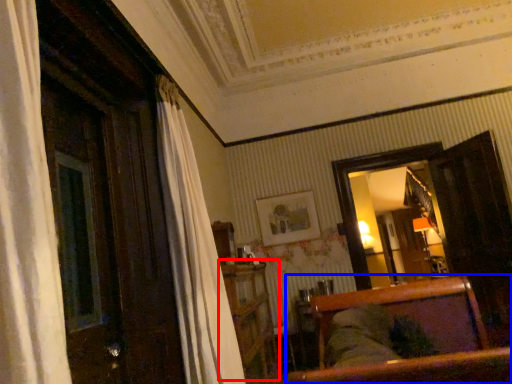
Question: Which object appears farthest to the camera in this image, dresser (highlighted by a red box) or furniture (highlighted by a blue box)?

Choices:
 (A) dresser
 (B) furniture

Answer: (A)